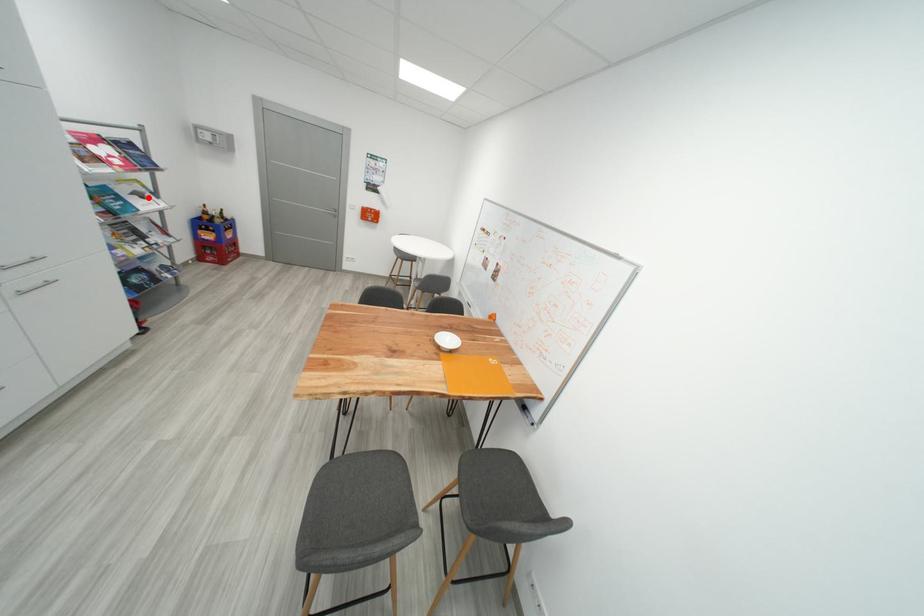
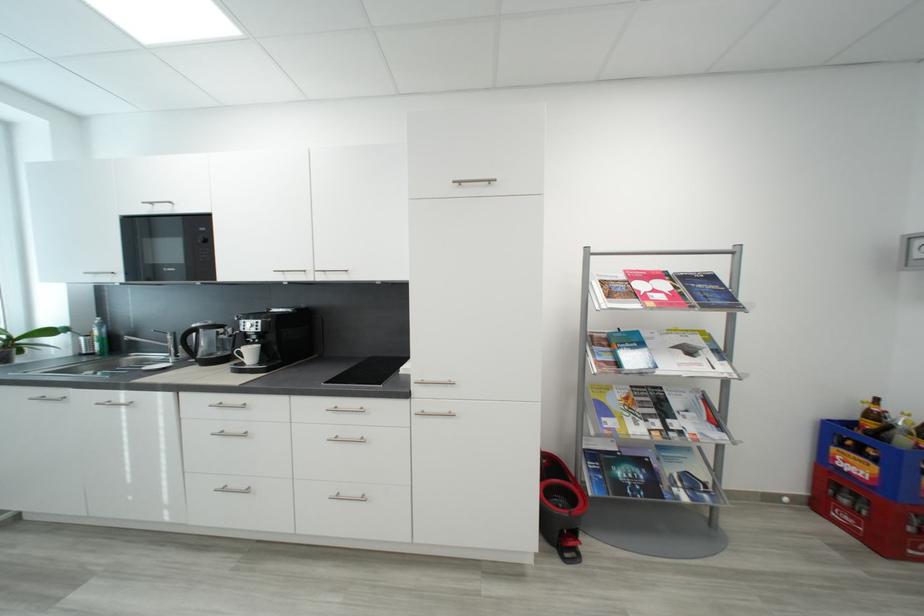
In the second image, find the point that corresponds to the highlighted location in the first image.

(697, 353)